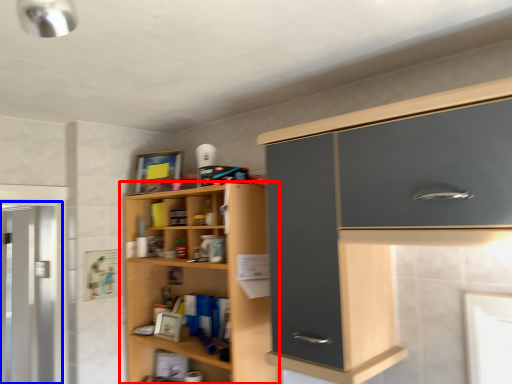
Question: Among these objects, which one is nearest to the camera, cupboard (highlighted by a red box) or screen door (highlighted by a blue box)?

Choices:
 (A) cupboard
 (B) screen door

Answer: (A)